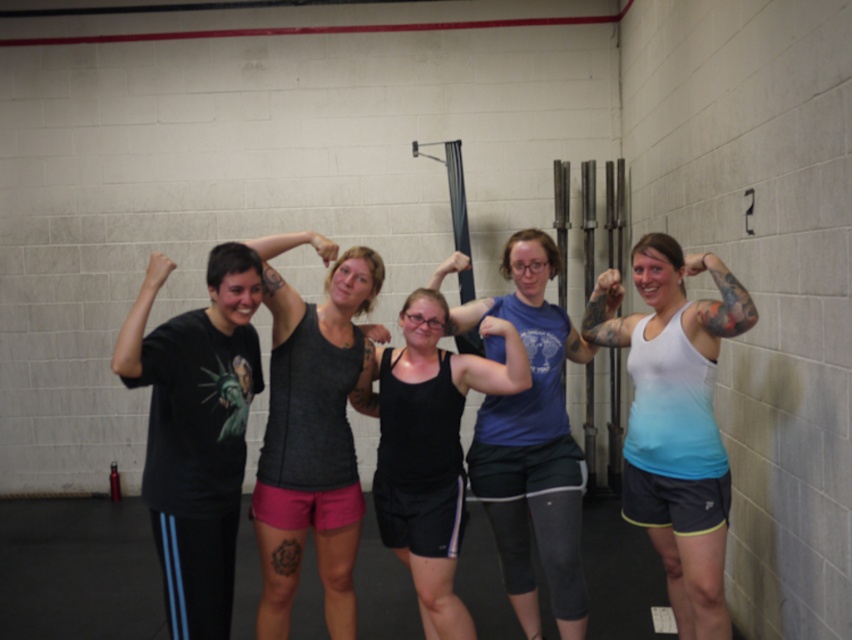
Who is positioned more to the right, black matte t-shirt at left or dark gray tank top at center?

dark gray tank top at center is more to the right.

Does black matte t-shirt at left appear over dark gray tank top at center?

Correct, black matte t-shirt at left is located above dark gray tank top at center.

Describe the element at coordinates (196, 432) in the screenshot. The image size is (852, 640). I see `black matte t-shirt at left` at that location.

You are a GUI agent. You are given a task and a screenshot of the screen. Output one action in this format:
    pyautogui.click(x=<x>, y=<y>)
    Task: Click on the black matte t-shirt at left
    
    Given the screenshot: What is the action you would take?
    pyautogui.click(x=196, y=432)

Which of these two, white gradient tank top at right or dark gray tank top at center, stands taller?

Standing taller between the two is dark gray tank top at center.

How distant is white gradient tank top at right from dark gray tank top at center?

→ 1.23 meters

Does point (707, 262) come farther from viewer compared to point (295, 387)?

No.

This screenshot has width=852, height=640. I want to click on white gradient tank top at right, so click(675, 419).

Who is positioned more to the left, black matte t-shirt at left or black matte tank top at center?

black matte t-shirt at left is more to the left.

Is black matte t-shirt at left smaller than black matte tank top at center?

Yes.

What do you see at coordinates (196, 432) in the screenshot? I see `black matte t-shirt at left` at bounding box center [196, 432].

At what (x,y) coordinates should I click in order to perform the action: click on black matte t-shirt at left. Please return your answer as a coordinate pair (x, y). Looking at the image, I should click on (196, 432).